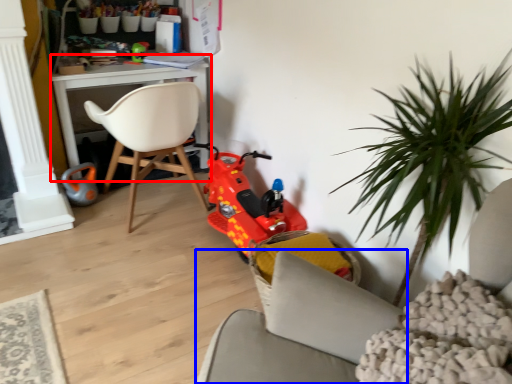
Question: Among these objects, which one is nearest to the camera, table (highlighted by a red box) or chair (highlighted by a blue box)?

Choices:
 (A) table
 (B) chair

Answer: (B)